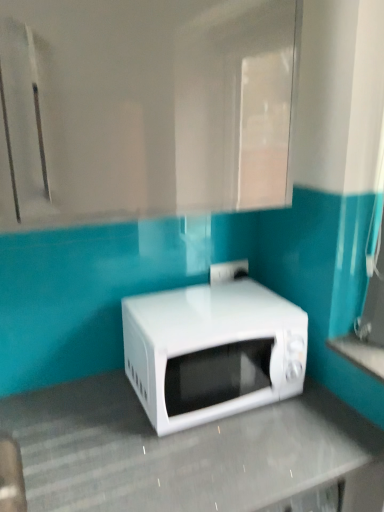
Question: Is white glossy microwave at center far from white glossy countertop at lower right, the first counter top when ordered from top to bottom?

Choices:
 (A) yes
 (B) no

Answer: (B)

Question: Is white glossy microwave at center to the right of white glossy countertop at lower right, which is counted as the 1th counter top, starting from the right, from the viewer's perspective?

Choices:
 (A) yes
 (B) no

Answer: (B)

Question: Is white glossy microwave at center outside of white glossy countertop at lower right, placed as the second counter top when sorted from bottom to top?

Choices:
 (A) yes
 (B) no

Answer: (A)

Question: From a real-world perspective, is white glossy microwave at center below white glossy countertop at lower right, placed as the second counter top when sorted from bottom to top?

Choices:
 (A) yes
 (B) no

Answer: (A)

Question: Is white glossy microwave at center surrounding white glossy countertop at lower right, the first counter top when ordered from top to bottom?

Choices:
 (A) no
 (B) yes

Answer: (A)

Question: From a real-world perspective, is white glossy microwave at center, the first counter top from the bottom, positioned above or below white glossy microwave at center?

Choices:
 (A) below
 (B) above

Answer: (A)

Question: Considering the positions of white glossy microwave at center, the 2th counter top when ordered from right to left, and white glossy microwave at center in the image, is white glossy microwave at center, the 2th counter top when ordered from right to left, taller or shorter than white glossy microwave at center?

Choices:
 (A) tall
 (B) short

Answer: (A)

Question: Choose the correct answer: Is white glossy microwave at center, placed as the 2th counter top when sorted from top to bottom, inside white glossy microwave at center or outside it?

Choices:
 (A) inside
 (B) outside

Answer: (B)

Question: In the image, is white glossy microwave at center, the first counter top from the bottom, positioned in front of or behind white glossy microwave at center?

Choices:
 (A) front
 (B) behind

Answer: (A)

Question: Considering their positions, is white glossy countertop at lower right, the second counter top when ordered from left to right, located in front of or behind white glossy microwave at center?

Choices:
 (A) front
 (B) behind

Answer: (A)

Question: From a real-world perspective, is white glossy countertop at lower right, the second counter top when ordered from left to right, positioned above or below white glossy microwave at center?

Choices:
 (A) above
 (B) below

Answer: (A)

Question: From the image's perspective, is white glossy countertop at lower right, the second counter top when ordered from left to right, located above or below white glossy microwave at center?

Choices:
 (A) above
 (B) below

Answer: (B)

Question: Based on their positions, is white glossy countertop at lower right, placed as the second counter top when sorted from bottom to top, located to the left or right of white glossy microwave at center?

Choices:
 (A) left
 (B) right

Answer: (B)

Question: From a real-world perspective, is white glossy countertop at lower right, the first counter top when ordered from top to bottom, physically located above or below white glossy microwave at center, placed as the 2th counter top when sorted from top to bottom?

Choices:
 (A) above
 (B) below

Answer: (A)

Question: Is point (344, 351) positioned closer to the camera than point (200, 460)?

Choices:
 (A) farther
 (B) closer

Answer: (A)